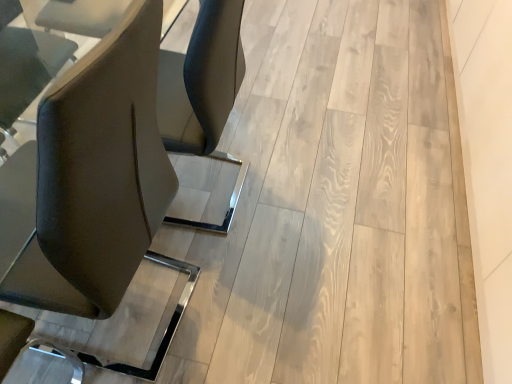
Question: Is matte black chair at left inside or outside of natural wood floor at center?

Choices:
 (A) outside
 (B) inside

Answer: (A)

Question: In terms of width, does matte black chair at left look wider or thinner when compared to natural wood floor at center?

Choices:
 (A) wide
 (B) thin

Answer: (B)

Question: Does point (41, 304) appear closer or farther from the camera than point (394, 135)?

Choices:
 (A) farther
 (B) closer

Answer: (B)

Question: From the image's perspective, is natural wood floor at center located above or below matte black chair at left?

Choices:
 (A) above
 (B) below

Answer: (A)

Question: Is natural wood floor at center wider or thinner than matte black chair at left?

Choices:
 (A) wide
 (B) thin

Answer: (A)

Question: Is natural wood floor at center spatially inside matte black chair at left, or outside of it?

Choices:
 (A) outside
 (B) inside

Answer: (A)

Question: Visually, is natural wood floor at center positioned to the left or to the right of matte black chair at left?

Choices:
 (A) right
 (B) left

Answer: (A)